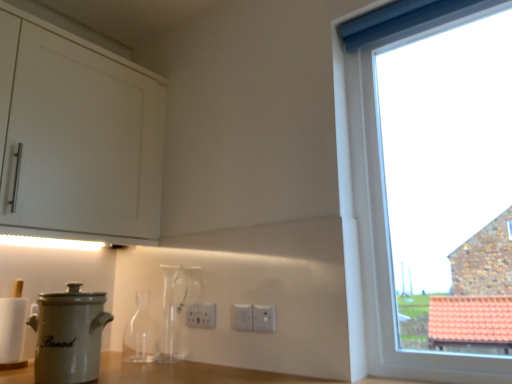
At what (x,y) coordinates should I click in order to perform the action: click on white plastic electric outlet at center, positioned as the third electric outlet in front-to-back order. Please return your answer as a coordinate pair (x, y). The height and width of the screenshot is (384, 512). Looking at the image, I should click on (201, 315).

The height and width of the screenshot is (384, 512). Describe the element at coordinates (377, 237) in the screenshot. I see `transparent glass window at right` at that location.

Identify the location of white ceramic bread bin at lower left. The width and height of the screenshot is (512, 384). (69, 335).

What do you see at coordinates (76, 136) in the screenshot? I see `white matte cabinet at upper left` at bounding box center [76, 136].

At what (x,y) coordinates should I click in order to perform the action: click on transparent glass bottle at center, the 1th bottle from the right. Please return your answer as a coordinate pair (x, y). This screenshot has width=512, height=384. Looking at the image, I should click on (173, 315).

Is transparent glass window at right oriented towards transparent glass bottle at center, the 2th bottle viewed from the right?

No, transparent glass window at right is not facing towards transparent glass bottle at center, the 2th bottle viewed from the right.

From the image's perspective, is transparent glass window at right located above transparent glass bottle at center, the 2th bottle viewed from the right?

Yes, from the image's perspective, transparent glass window at right is over transparent glass bottle at center, the 2th bottle viewed from the right.

Which is closer to the camera, (336, 75) or (147, 343)?

Positioned in front is point (336, 75).

Would you say transparent glass window at right contains transparent glass bottle at center, the 2th bottle viewed from the right?

No.

From a real-world perspective, between white plastic electric outlet at center, marked as the 1th electric outlet in a back-to-front arrangement, and white matte cabinet at upper left, who is vertically higher?

white matte cabinet at upper left, from a real-world perspective.

From the image's perspective, does white plastic electric outlet at center, placed as the first electric outlet when sorted from left to right, appear higher than white matte cabinet at upper left?

No.

Is white plastic electric outlet at center, marked as the 3th electric outlet in a right-to-left arrangement, facing away from white matte cabinet at upper left?

No, white plastic electric outlet at center, marked as the 3th electric outlet in a right-to-left arrangement, is not facing away from white matte cabinet at upper left.

Which point is more distant from viewer, (211, 314) or (175, 284)?

The point (175, 284) is behind.

Between white plastic electric outlet at center, placed as the first electric outlet when sorted from left to right, and transparent glass bottle at center, the 1th bottle from the right, which one has less height?

white plastic electric outlet at center, placed as the first electric outlet when sorted from left to right, is shorter.

Is transparent glass bottle at center, placed as the second bottle when sorted from left to right, surrounded by white plastic electric outlet at center, placed as the first electric outlet when sorted from left to right?

No, white plastic electric outlet at center, placed as the first electric outlet when sorted from left to right, does not contain transparent glass bottle at center, placed as the second bottle when sorted from left to right.

Who is smaller, white plastic electric outlet at center, placed as the first electric outlet when sorted from left to right, or transparent glass bottle at center, placed as the second bottle when sorted from left to right?

white plastic electric outlet at center, placed as the first electric outlet when sorted from left to right, is smaller.

Is white ceramic bread bin at lower left oriented away from transparent glass window at right?

That's not correct — white ceramic bread bin at lower left is not looking away from transparent glass window at right.

Considering the sizes of objects white ceramic bread bin at lower left and transparent glass window at right in the image provided, who is wider, white ceramic bread bin at lower left or transparent glass window at right?

With larger width is white ceramic bread bin at lower left.

Considering the points (74, 282) and (376, 368), which point is behind, point (74, 282) or point (376, 368)?

Positioned behind is point (74, 282).

How much distance is there between white ceramic bread bin at lower left and transparent glass window at right?

white ceramic bread bin at lower left and transparent glass window at right are 84.36 centimeters apart from each other.

In terms of size, does transparent glass bottle at center, which is the first bottle in left-to-right order, appear bigger or smaller than white plastic electric outlet at center, positioned as the third electric outlet in front-to-back order?

Considering their sizes, transparent glass bottle at center, which is the first bottle in left-to-right order, takes up more space than white plastic electric outlet at center, positioned as the third electric outlet in front-to-back order.

How many degrees apart are the facing directions of transparent glass bottle at center, the 2th bottle viewed from the right, and white plastic electric outlet at center, marked as the 3th electric outlet in a right-to-left arrangement?

There is a 1.17-degree angle between the facing directions of transparent glass bottle at center, the 2th bottle viewed from the right, and white plastic electric outlet at center, marked as the 3th electric outlet in a right-to-left arrangement.

Does point (137, 321) appear closer or farther from the camera than point (190, 318)?

Point (137, 321) is farther from the camera than point (190, 318).

From the image's perspective, is transparent glass bottle at center, the 2th bottle viewed from the right, above or below white plastic electric outlet at center, marked as the 1th electric outlet in a back-to-front arrangement?

Clearly, from the image's perspective, transparent glass bottle at center, the 2th bottle viewed from the right, is below white plastic electric outlet at center, marked as the 1th electric outlet in a back-to-front arrangement.

Locate an element on the screen. kitchen appliance below the white plastic electric outlet at center, placed as the first electric outlet when sorted from left to right (from a real-world perspective) is located at coordinates (69, 335).

From a real-world perspective, is white ceramic bread bin at lower left below white plastic electric outlet at center, placed as the first electric outlet when sorted from left to right?

Yes.

Which is in front, point (94, 365) or point (204, 303)?

The point (94, 365) is closer.

Is white ceramic bread bin at lower left aimed at white ceramic mug at lower left?

No, white ceramic bread bin at lower left does not turn towards white ceramic mug at lower left.

The height and width of the screenshot is (384, 512). I want to click on kitchen appliance located in front of the white ceramic mug at lower left, so click(x=69, y=335).

From the image's perspective, relative to white ceramic mug at lower left, is white ceramic bread bin at lower left above or below?

Based on their image positions, white ceramic bread bin at lower left is located above white ceramic mug at lower left.

Does white ceramic bread bin at lower left come in front of white ceramic mug at lower left?

That is True.

The width and height of the screenshot is (512, 384). Identify the location of window that appears on the right of transparent glass bottle at center, the 2th bottle viewed from the right. (377, 237).

The image size is (512, 384). Identify the location of the 3rd electric outlet behind the white matte cabinet at upper left. (201, 315).

Estimate the real-world distances between objects in this image. Which object is further from transparent glass window at right, white plastic electric outlet at center, placed as the first electric outlet when sorted from left to right, or white matte cabinet at upper left?

Based on the image, white matte cabinet at upper left appears to be further to transparent glass window at right.

Estimate the real-world distances between objects in this image. Which object is further from transparent glass bottle at center, which is the first bottle in left-to-right order, white matte cabinet at upper left or white ceramic mug at lower left?

white matte cabinet at upper left is positioned further to the anchor transparent glass bottle at center, which is the first bottle in left-to-right order.

When comparing their distances from transparent glass bottle at center, the 1th bottle from the right, does white plastic electric outlet at center, which is the 2th electric outlet in back-to-front order, or white plastic electric outlet at center, marked as the 3th electric outlet in a right-to-left arrangement, seem closer?

white plastic electric outlet at center, marked as the 3th electric outlet in a right-to-left arrangement.

Based on their spatial positions, is white ceramic bread bin at lower left or white plastic electric outlet at center, which ranks as the third electric outlet in left-to-right order, closer to white plastic electric outlet at center, placed as the first electric outlet when sorted from left to right?

white plastic electric outlet at center, which ranks as the third electric outlet in left-to-right order, is closer to white plastic electric outlet at center, placed as the first electric outlet when sorted from left to right.

From the image, which object appears to be nearer to transparent glass bottle at center, the 2th bottle viewed from the right, white plastic electric outlet at center, which is the 2th electric outlet from left to right, or white ceramic bread bin at lower left?

white plastic electric outlet at center, which is the 2th electric outlet from left to right, is positioned closer to the anchor transparent glass bottle at center, the 2th bottle viewed from the right.

From the image, which object appears to be farther from white plastic electric outlet at center, marked as the 1th electric outlet in a right-to-left arrangement, white plastic electric outlet at center, marked as the 3th electric outlet in a right-to-left arrangement, or transparent glass bottle at center, which is the first bottle in left-to-right order?

transparent glass bottle at center, which is the first bottle in left-to-right order, lies further to white plastic electric outlet at center, marked as the 1th electric outlet in a right-to-left arrangement, than the other object.

Looking at the image, which one is located further to white matte cabinet at upper left, white plastic electric outlet at center, marked as the 3th electric outlet in a right-to-left arrangement, or white plastic electric outlet at center, which is the 2th electric outlet from left to right?

Based on the image, white plastic electric outlet at center, which is the 2th electric outlet from left to right, appears to be further to white matte cabinet at upper left.

Estimate the real-world distances between objects in this image. Which object is closer to white matte cabinet at upper left, transparent glass bottle at center, which is the first bottle in left-to-right order, or transparent glass bottle at center, the 1th bottle from the right?

transparent glass bottle at center, the 1th bottle from the right, is closer to white matte cabinet at upper left.

The height and width of the screenshot is (384, 512). What are the coordinates of `kitchen appliance between white matte cabinet at upper left and white ceramic mug at lower left in the vertical direction` in the screenshot? It's located at (69, 335).

At what (x,y) coordinates should I click in order to perform the action: click on appliance between white matte cabinet at upper left and white plastic electric outlet at center, placed as the first electric outlet when sorted from left to right, vertically. Please return your answer as a coordinate pair (x, y). Looking at the image, I should click on (13, 332).

Find the location of `kitchen appliance located between white matte cabinet at upper left and white plastic electric outlet at center, the second electric outlet in the front-to-back sequence, in the left-right direction`. kitchen appliance located between white matte cabinet at upper left and white plastic electric outlet at center, the second electric outlet in the front-to-back sequence, in the left-right direction is located at coordinates (69, 335).

Find the location of a particular element. The width and height of the screenshot is (512, 384). kitchen appliance between white matte cabinet at upper left and transparent glass bottle at center, which is the first bottle in left-to-right order, from top to bottom is located at coordinates (69, 335).